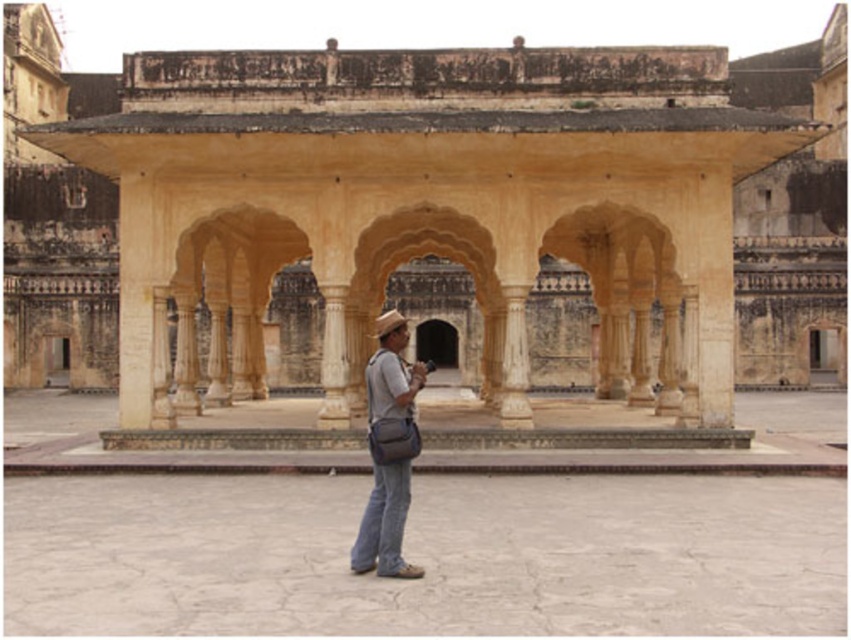
Is beige stone palace at center bigger than denim at center?

Indeed, beige stone palace at center has a larger size compared to denim at center.

Between point (184, 200) and point (392, 566), which one is positioned behind?

The point (184, 200) is more distant.

You are a GUI agent. You are given a task and a screenshot of the screen. Output one action in this format:
    pyautogui.click(x=<x>, y=<y>)
    Task: Click on the beige stone palace at center
    
    Given the screenshot: What is the action you would take?
    pyautogui.click(x=437, y=220)

Is beige stone palace at center to the left of denim jeans at center from the viewer's perspective?

Incorrect, beige stone palace at center is not on the left side of denim jeans at center.

Which is behind, point (283, 243) or point (381, 348)?

Point (283, 243)

Where is `beige stone palace at center`? The width and height of the screenshot is (851, 640). beige stone palace at center is located at coordinates (437, 220).

Who is higher up, denim jeans at center or denim at center?

denim jeans at center

Who is more forward, [380,419] or [413,570]?

Point [413,570] is in front.

Identify the location of denim jeans at center. (389, 451).